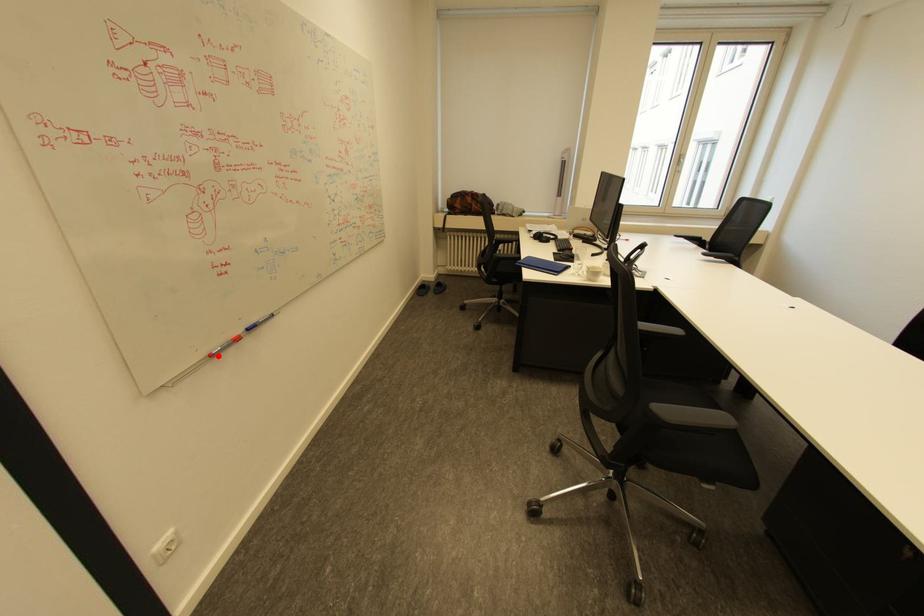
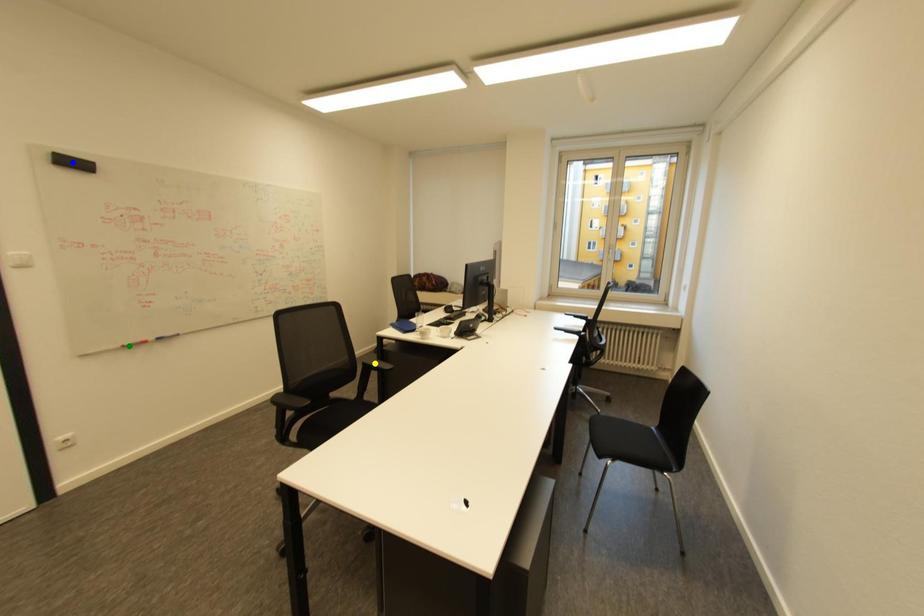
Question: I am providing you with two images of the same scene from different viewpoints. A red point is marked on the first image. You are given multiple points on the second image. Which mark in image 2 goes with the point in image 1?

Choices:
 (A) blue point
 (B) green point
 (C) yellow point

Answer: (B)